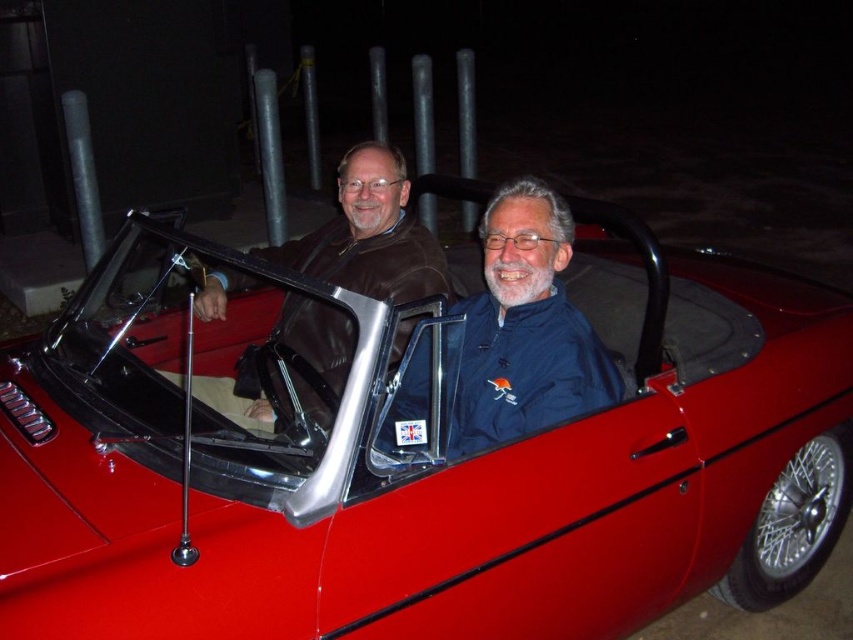
Does shiny red convertible at center have a lesser height compared to blue fabric jacket at center?

No, shiny red convertible at center is not shorter than blue fabric jacket at center.

Can you confirm if shiny red convertible at center is positioned to the right of blue fabric jacket at center?

In fact, shiny red convertible at center is to the left of blue fabric jacket at center.

I want to click on shiny red convertible at center, so click(x=426, y=467).

Which is below, blue fabric jacket at center or brown leather jacket at center?

blue fabric jacket at center is below.

Between point (503, 310) and point (387, 200), which one is positioned in front?

Positioned in front is point (503, 310).

Is point (515, 321) closer to viewer compared to point (410, 326)?

That is True.

The width and height of the screenshot is (853, 640). I want to click on blue fabric jacket at center, so click(x=524, y=330).

Can you confirm if shiny red convertible at center is positioned below brown leather jacket at center?

Correct, shiny red convertible at center is located below brown leather jacket at center.

Describe the element at coordinates (426, 467) in the screenshot. I see `shiny red convertible at center` at that location.

Where is `shiny red convertible at center`? The width and height of the screenshot is (853, 640). shiny red convertible at center is located at coordinates (426, 467).